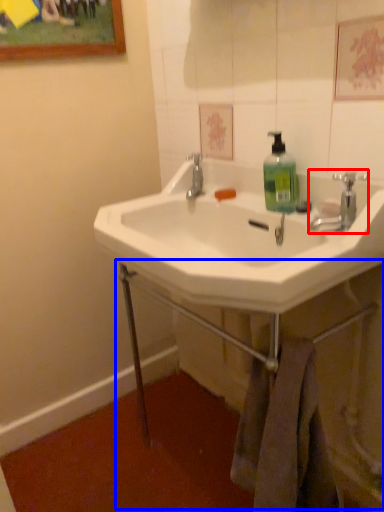
Question: Which object appears closest to the camera in this image, tap (highlighted by a red box) or counter (highlighted by a blue box)?

Choices:
 (A) tap
 (B) counter

Answer: (B)